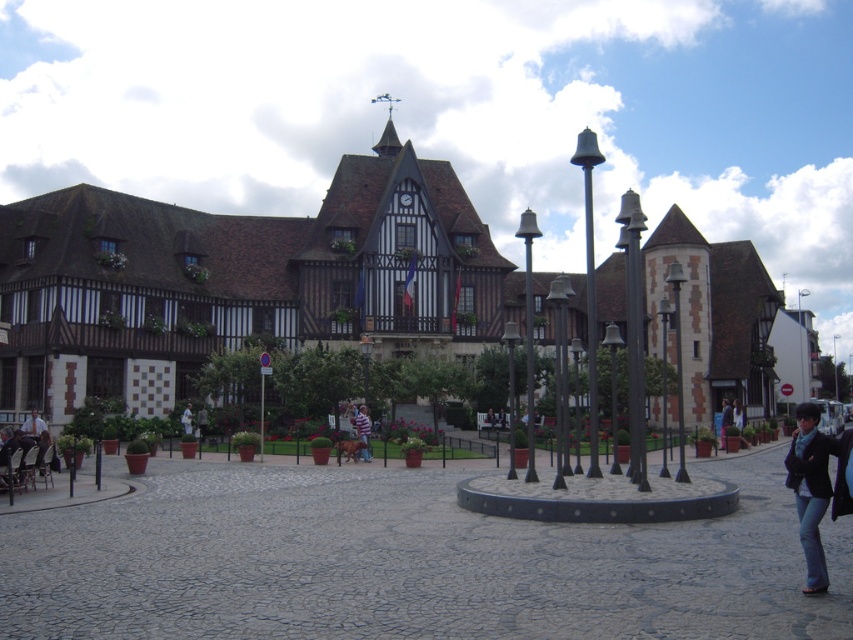
You are a tourist standing in the town square and notice both the wooden timber building at center and the striped shirt at center. Which object is larger in size?

The wooden timber building at center is bigger than the striped shirt at center, so the wooden timber building at center is larger in size.

You are a tourist standing in the town square and see the black leather jacket at lower right and the white cotton shirt at center. Which item is closer to the ground?

The black leather jacket at lower right is positioned under the white cotton shirt at center, so it is closer to the ground.

In the scene shown: You are a tourist standing in the town square and want to take a photo of the wooden timber building at center without the striped shirt at center appearing in the shot. How can you adjust your position to achieve this?

The wooden timber building at center is positioned over the striped shirt at center, so you can move either to the left or right to shift the angle and avoid the striped shirt at center appearing in the frame.